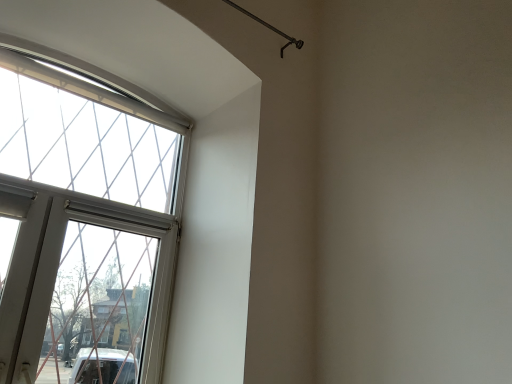
The height and width of the screenshot is (384, 512). Find the location of `clear glass window at left`. clear glass window at left is located at coordinates (86, 225).

What do you see at coordinates (86, 225) in the screenshot? This screenshot has height=384, width=512. I see `clear glass window at left` at bounding box center [86, 225].

Identify the location of clear glass window at left. This screenshot has height=384, width=512. (86, 225).